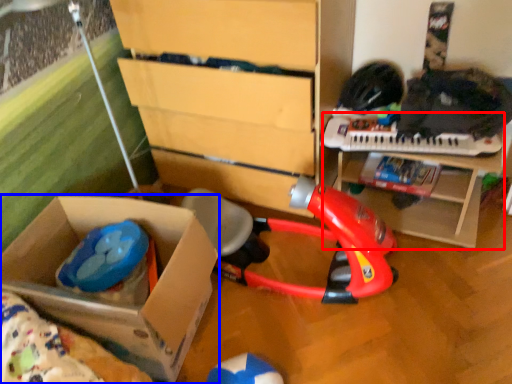
Question: Which object appears farthest to the camera in this image, table (highlighted by a red box) or box (highlighted by a blue box)?

Choices:
 (A) table
 (B) box

Answer: (A)